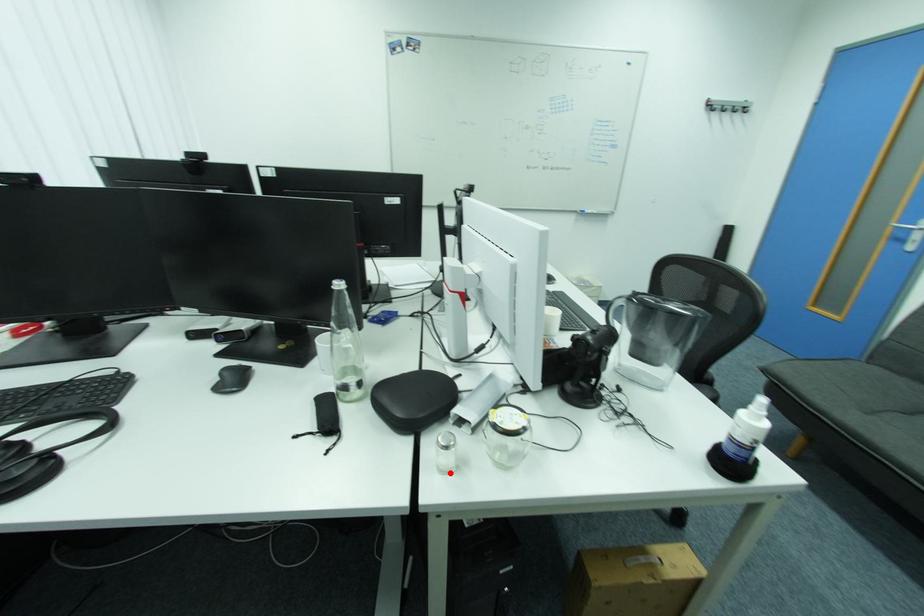
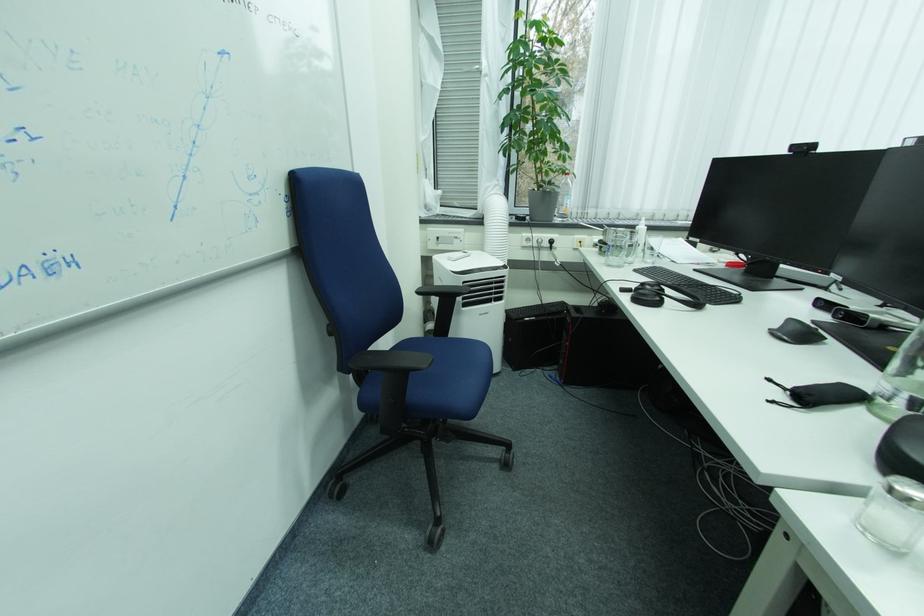
Question: I am providing you with two images of the same scene from different viewpoints. A red point is marked on the first image. At the location where the point appears in image 1, is it still visible in image 2?

Choices:
 (A) Yes
 (B) No

Answer: (A)